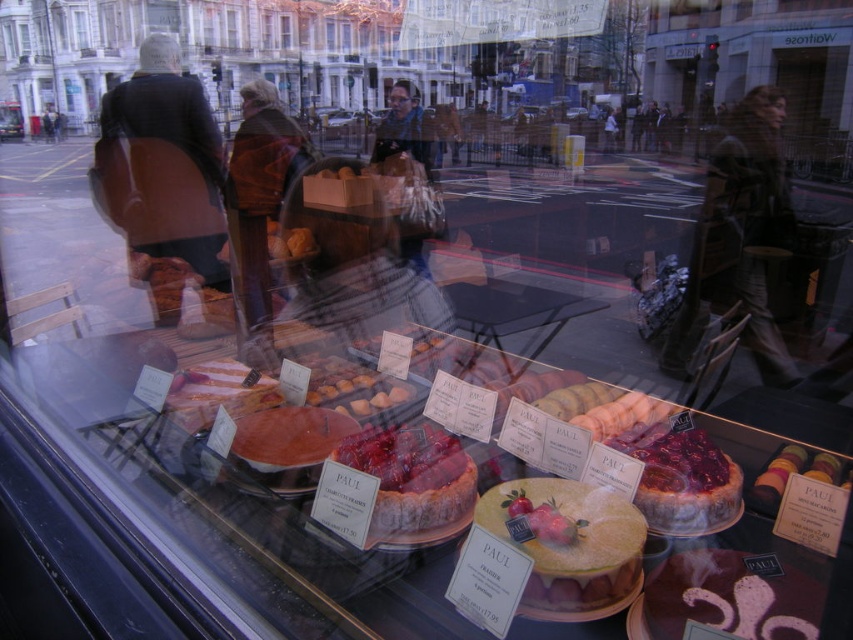
Is point (689, 278) in front of point (544, 490)?

No, (689, 278) is behind (544, 490).

Is brown leather jacket at center wider than golden sponge cake at center?

Correct, the width of brown leather jacket at center exceeds that of golden sponge cake at center.

You are a GUI agent. You are given a task and a screenshot of the screen. Output one action in this format:
    pyautogui.click(x=<x>, y=<y>)
    Task: Click on the brown leather jacket at center
    
    Given the screenshot: What is the action you would take?
    click(x=738, y=240)

Identify the location of brown leather jacket at center. The width and height of the screenshot is (853, 640). (738, 240).

Who is more forward, (762, 332) or (241, 173)?

Positioned in front is point (241, 173).

Which is above, brown leather jacket at center or brown wool scarf at center?

brown wool scarf at center is above.

This screenshot has height=640, width=853. In order to click on brown leather jacket at center in this screenshot , I will do `click(738, 240)`.

The width and height of the screenshot is (853, 640). Identify the location of brown leather jacket at center. (738, 240).

Based on the photo, can you confirm if glazed raspberry cheesecake at center is taller than matte black jacket at center?

In fact, glazed raspberry cheesecake at center may be shorter than matte black jacket at center.

Does point (657, 449) come behind point (398, 125)?

No, it is in front of (398, 125).

Which is behind, point (659, 468) or point (379, 150)?

The point (379, 150) is more distant.

This screenshot has height=640, width=853. I want to click on glazed raspberry cheesecake at center, so click(x=682, y=480).